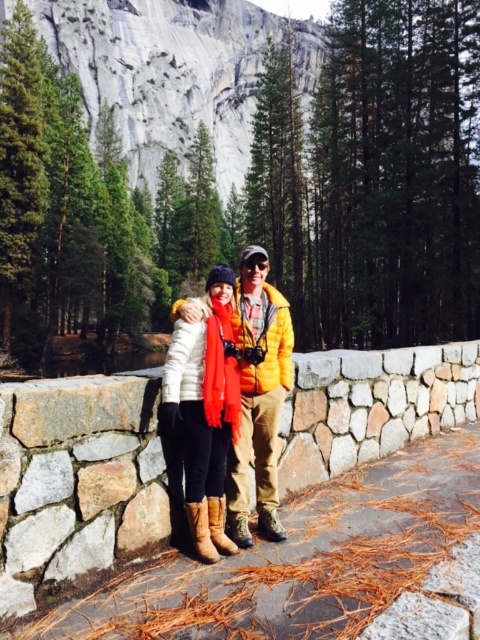
You are a hiker who wants to place a 100 feet long tent between the matte white rock at upper center and the brown suede boot at lower center. Is there enough space?

The distance between the matte white rock at upper center and the brown suede boot at lower center is 659.64 feet, so yes, there is enough space to place a 100 feet long tent between them.

You are standing in the scenic outdoor setting and want to place a small bench between the two points labeled point (135, 38) and point (200, 524). Which point should the bench be closer to so that it appears closer to the viewer?

The bench should be closer to point (135, 38) because it is further to the viewer than point (200, 524).